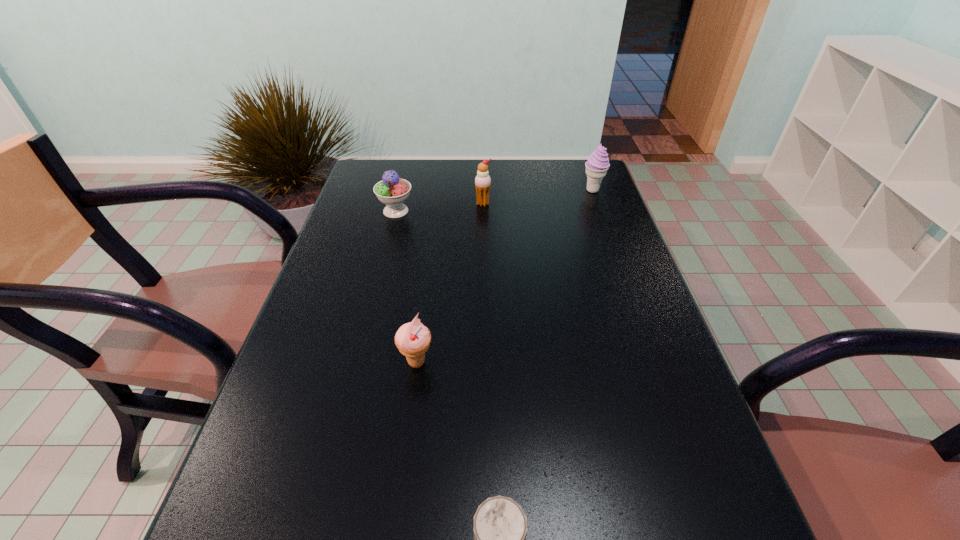
In order to click on object that is the fourth closest to the third icecream from left to right in this screenshot , I will do `click(500, 526)`.

Identify which object is the closest to the second icecream from right to left. Please provide its 2D coordinates. Your answer should be formatted as a tuple, i.e. [(x, y)], where the tuple contains the x and y coordinates of a point satisfying the conditions above.

[(392, 191)]

Choose which icecream is the nearest neighbor to the second icecream from right to left. Please provide its 2D coordinates. Your answer should be formatted as a tuple, i.e. [(x, y)], where the tuple contains the x and y coordinates of a point satisfying the conditions above.

[(392, 191)]

Identify which icecream is located as the second nearest to the shortest object. Please provide its 2D coordinates. Your answer should be formatted as a tuple, i.e. [(x, y)], where the tuple contains the x and y coordinates of a point satisfying the conditions above.

[(392, 191)]

You are a GUI agent. You are given a task and a screenshot of the screen. Output one action in this format:
    pyautogui.click(x=<x>, y=<y>)
    Task: Click on the free space that satisfies the following two spatial constraints: 1. on the front side of the second object from left to right; 2. on the left side of the leftmost icecream
    The width and height of the screenshot is (960, 540).
    Given the screenshot: What is the action you would take?
    pyautogui.click(x=357, y=362)

The height and width of the screenshot is (540, 960). Identify the location of vacant space that satisfies the following two spatial constraints: 1. on the front side of the fourth farthest object; 2. on the right side of the leftmost object. (357, 362).

Locate an element on the screen. This screenshot has width=960, height=540. blank area in the image that satisfies the following two spatial constraints: 1. on the back side of the farthest object; 2. on the left side of the leftmost object is located at coordinates (401, 191).